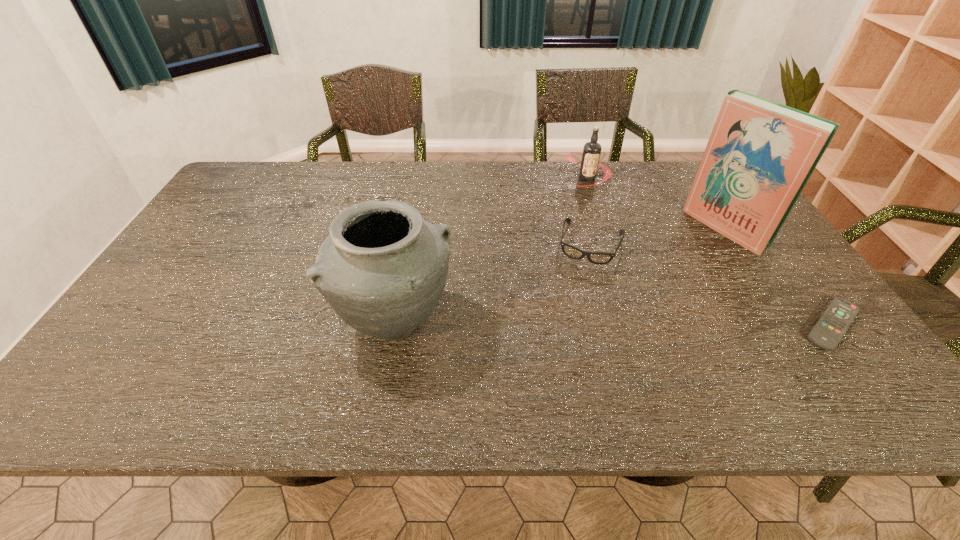
The image size is (960, 540). I want to click on vacant space on the desktop that is between the leftmost object and the shortest object and is positioned on the cover of the hardback book, so click(x=563, y=324).

The width and height of the screenshot is (960, 540). Identify the location of vacant space on the desktop that is between the second tallest object and the remote control and is positioned on the front-facing side of the spectacles. (567, 324).

I want to click on vacant spot on the desktop that is between the urn and the shortest object and is positioned on the label of the root beer, so click(550, 324).